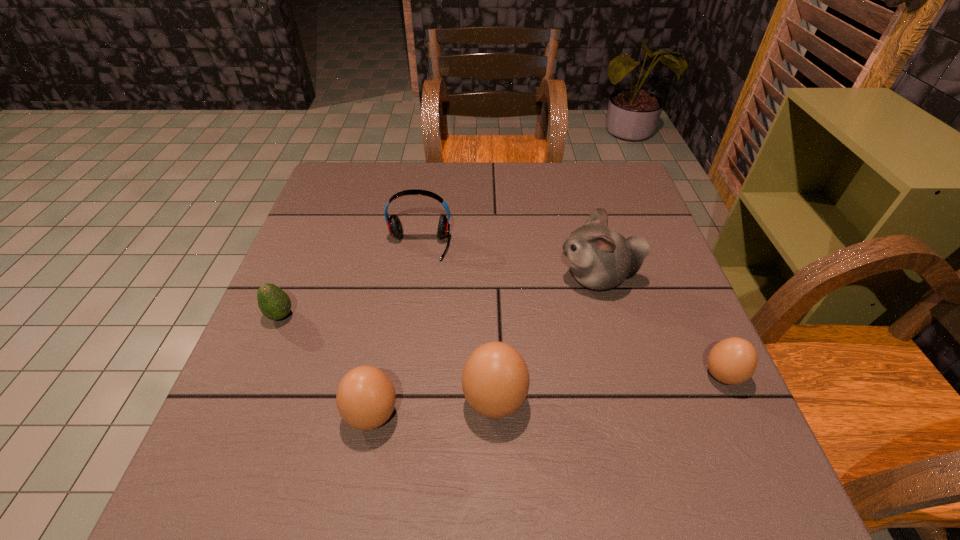
Where is `free location that satisfies the following two spatial constraints: 1. on the face of the hamster; 2. on the left side of the shortest boiled egg`? This screenshot has width=960, height=540. free location that satisfies the following two spatial constraints: 1. on the face of the hamster; 2. on the left side of the shortest boiled egg is located at coordinates (624, 375).

Image resolution: width=960 pixels, height=540 pixels. I want to click on free space that satisfies the following two spatial constraints: 1. on the face of the hamster; 2. on the front side of the avocado, so click(x=609, y=316).

The height and width of the screenshot is (540, 960). In order to click on free space that satisfies the following two spatial constraints: 1. on the face of the second object from right to left; 2. on the front side of the second shortest boiled egg in this screenshot , I will do `click(635, 415)`.

Where is `vacant area in the image that satisfies the following two spatial constraints: 1. on the front side of the third farthest object; 2. on the right side of the second boiled egg from right to left`? This screenshot has height=540, width=960. vacant area in the image that satisfies the following two spatial constraints: 1. on the front side of the third farthest object; 2. on the right side of the second boiled egg from right to left is located at coordinates (246, 401).

Locate an element on the screen. free space that satisfies the following two spatial constraints: 1. on the face of the rightmost boiled egg; 2. on the right side of the second object from right to left is located at coordinates (624, 375).